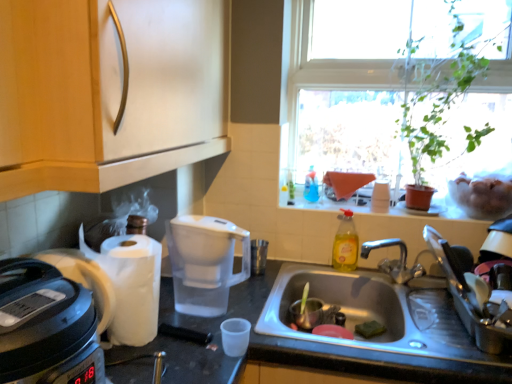
Question: In terms of size, does transparent plastic water filter at center appear bigger or smaller than metallic sink at lower center?

Choices:
 (A) small
 (B) big

Answer: (A)

Question: From their relative heights in the image, would you say transparent plastic water filter at center is taller or shorter than metallic sink at lower center?

Choices:
 (A) tall
 (B) short

Answer: (B)

Question: Considering the real-world distances, which object is farthest from the wooden cabinet at upper left?

Choices:
 (A) green leafy plant at upper right
 (B) metallic sink at lower center
 (C) stainless steel sink at lower center
 (D) yellow translucent bottle at sink, the 1th bottle in the bottom-to-top sequence
 (E) translucent plastic bottle at upper right, the 2th bottle in the front-to-back sequence

Answer: (E)

Question: Based on their relative distances, which object is farther from the wooden cabinet at upper left?

Choices:
 (A) white plastic rice cooker at left
 (B) transparent plastic water filter at center
 (C) metallic sink at lower center
 (D) transparent glass window at upper right
 (E) translucent plastic bottle at upper right, which is the 1th bottle from left to right

Answer: (E)